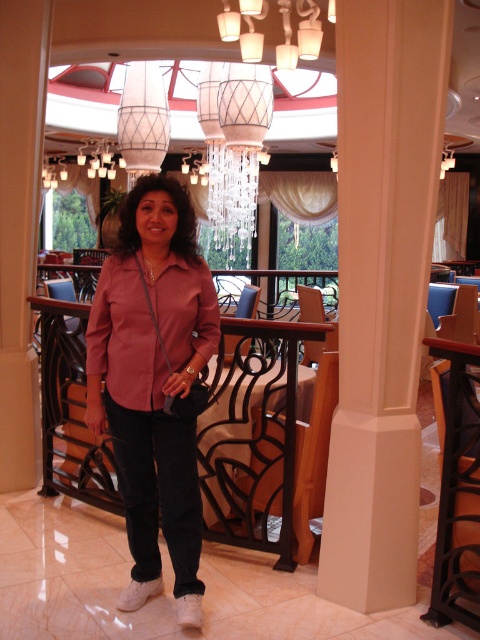
You are a photographer trying to capture the woman in the pink satin blouse at center and the beige smooth column at center. Which object is closer to you, the photographer?

The beige smooth column at center is closer to the photographer because it is further to the viewer than the pink satin blouse at center.

You are standing in the dining area and want to place a small decorative item between the two points, point (178, 497) and point (244, 536). Which point is closer to you where you should start placing the item?

Point (178, 497) is closer to the viewer than point (244, 536), so you should start placing the item near point (178, 497) first as it is closer.

You are a decorator planning to place a new sculpture between the beige smooth column at center and the matte glass chandelier at upper center. Which object should the sculpture be placed closer to if it needs to fit snugly between them?

The sculpture should be placed closer to the beige smooth column at center since it is thinner than the matte glass chandelier at upper center, allowing for a snug fit.